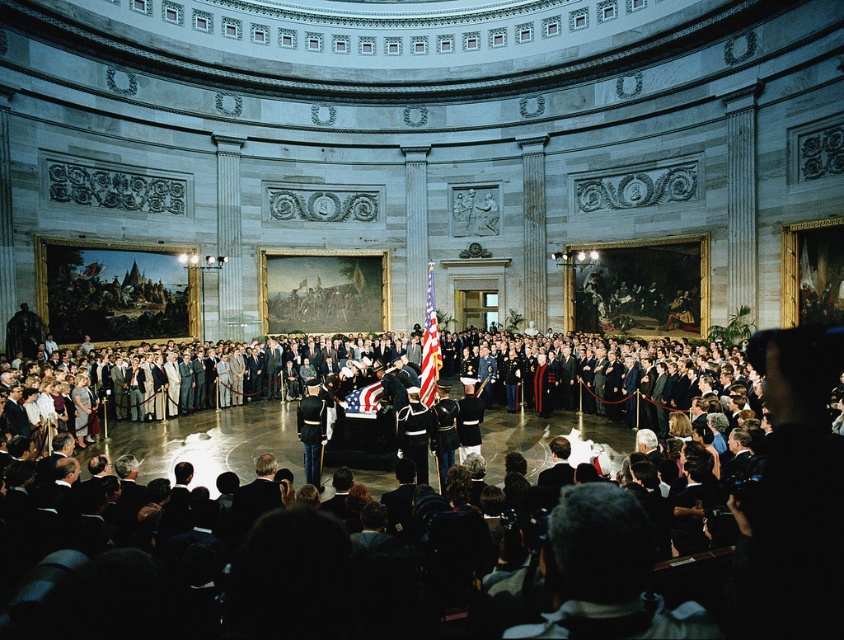
Question: Which object appears closest to the camera in this image?

Choices:
 (A) dark suit crowd at center
 (B) matte american flag at center
 (C) american flag at center

Answer: (A)

Question: Does dark suit crowd at center appear on the right side of matte american flag at center?

Choices:
 (A) yes
 (B) no

Answer: (A)

Question: Among these objects, which one is nearest to the camera?

Choices:
 (A) dark suit crowd at center
 (B) matte american flag at center

Answer: (A)

Question: Is dark suit crowd at center below matte american flag at center?

Choices:
 (A) yes
 (B) no

Answer: (A)

Question: Can you confirm if matte american flag at center is positioned to the left of american flag at center?

Choices:
 (A) yes
 (B) no

Answer: (B)

Question: Which point is farther to the camera?

Choices:
 (A) american flag at center
 (B) dark suit crowd at center

Answer: (A)